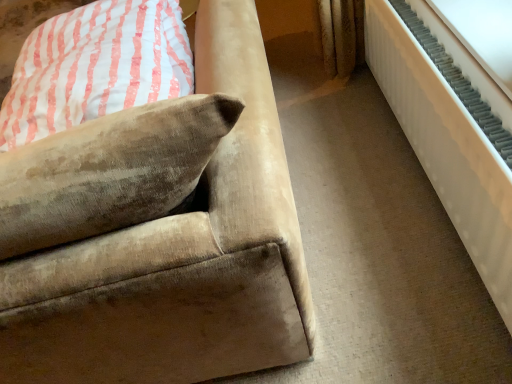
Question: Can you confirm if velvet beige couch at lower left is bigger than velvet beige pillow at upper left?

Choices:
 (A) yes
 (B) no

Answer: (A)

Question: Is velvet beige couch at lower left in front of velvet beige pillow at upper left?

Choices:
 (A) yes
 (B) no

Answer: (A)

Question: Is velvet beige couch at lower left thinner than velvet beige pillow at upper left?

Choices:
 (A) no
 (B) yes

Answer: (A)

Question: Does velvet beige couch at lower left have a smaller size compared to velvet beige pillow at upper left?

Choices:
 (A) yes
 (B) no

Answer: (B)

Question: From the image's perspective, would you say velvet beige couch at lower left is positioned over velvet beige pillow at upper left?

Choices:
 (A) no
 (B) yes

Answer: (B)

Question: Considering the positions of velvet beige couch at lower left and velvet beige pillow at upper left in the image, is velvet beige couch at lower left bigger or smaller than velvet beige pillow at upper left?

Choices:
 (A) big
 (B) small

Answer: (A)

Question: Is point (298, 231) closer or farther from the camera than point (130, 18)?

Choices:
 (A) closer
 (B) farther

Answer: (A)

Question: From a real-world perspective, is velvet beige couch at lower left above or below velvet beige pillow at upper left?

Choices:
 (A) above
 (B) below

Answer: (B)

Question: From the image's perspective, is velvet beige couch at lower left positioned above or below velvet beige pillow at upper left?

Choices:
 (A) below
 (B) above

Answer: (B)

Question: From the image's perspective, is velvet beige couch at lower left above or below white textured radiator at right?

Choices:
 (A) below
 (B) above

Answer: (B)

Question: From a real-world perspective, relative to white textured radiator at right, is velvet beige couch at lower left vertically above or below?

Choices:
 (A) below
 (B) above

Answer: (B)

Question: Based on their sizes in the image, would you say velvet beige couch at lower left is bigger or smaller than white textured radiator at right?

Choices:
 (A) small
 (B) big

Answer: (B)

Question: Is velvet beige couch at lower left situated inside white textured radiator at right or outside?

Choices:
 (A) outside
 (B) inside

Answer: (A)

Question: From a real-world perspective, relative to velvet beige pillow at upper left, is white textured radiator at right vertically above or below?

Choices:
 (A) above
 (B) below

Answer: (B)

Question: Considering the positions of point (443, 183) and point (69, 92), is point (443, 183) closer or farther from the camera than point (69, 92)?

Choices:
 (A) farther
 (B) closer

Answer: (A)